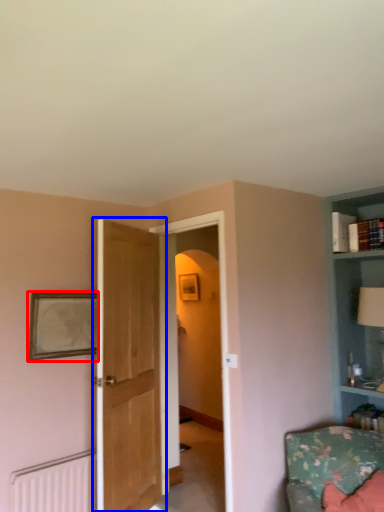
Question: Which object appears farthest to the camera in this image, picture frame (highlighted by a red box) or door (highlighted by a blue box)?

Choices:
 (A) picture frame
 (B) door

Answer: (A)